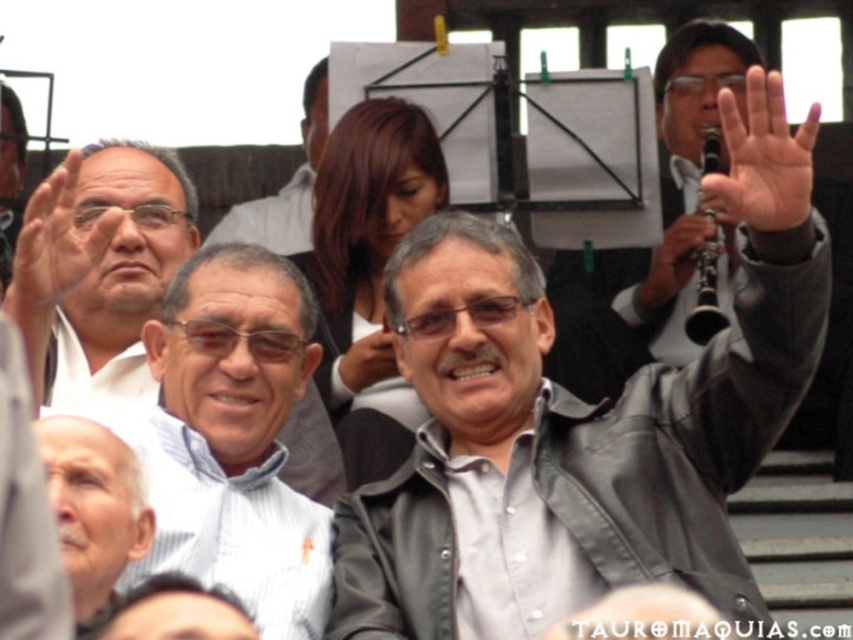
Between white striped shirt at left and black leather clarinet at upper right, which one is positioned higher?

black leather clarinet at upper right is above.

Who is shorter, white striped shirt at left or black leather clarinet at upper right?

With less height is black leather clarinet at upper right.

This screenshot has width=853, height=640. I want to click on white striped shirt at left, so click(x=112, y=269).

Who is shorter, matte white shirt at upper center or matte black hand at center?

With less height is matte black hand at center.

Who is lower down, matte white shirt at upper center or matte black hand at center?

matte black hand at center

Does point (265, 237) come closer to viewer compared to point (367, 364)?

No, (265, 237) is further to viewer.

Identify the location of matte white shirt at upper center. The image size is (853, 640). (285, 186).

Who is more distant from viewer, (346, 609) or (670, 264)?

Positioned behind is point (670, 264).

Between point (579, 573) and point (672, 266), which one is positioned in front?

Positioned in front is point (579, 573).

Locate an element on the screen. The width and height of the screenshot is (853, 640). leather jacket at center is located at coordinates (579, 420).